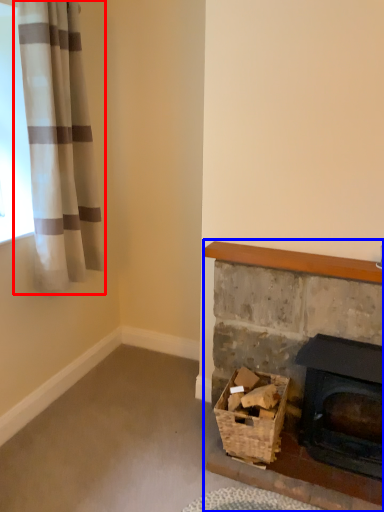
Question: Which of the following is the closest to the observer, curtain (highlighted by a red box) or fireplace (highlighted by a blue box)?

Choices:
 (A) curtain
 (B) fireplace

Answer: (A)